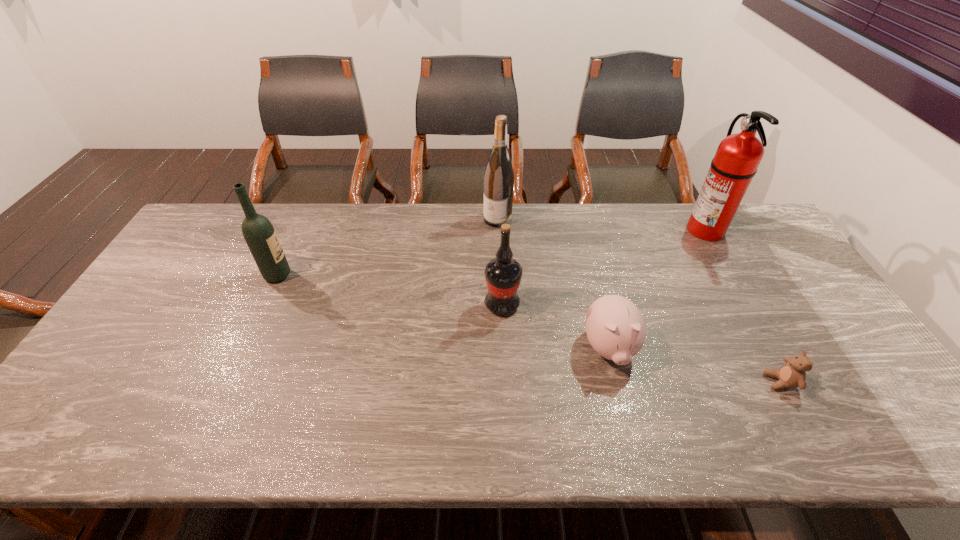
Identify the location of fire extinguisher. The width and height of the screenshot is (960, 540). (738, 156).

Where is `the farthest wine bottle`? This screenshot has width=960, height=540. the farthest wine bottle is located at coordinates (499, 177).

The width and height of the screenshot is (960, 540). What are the coordinates of `the fourth nearest object` in the screenshot? It's located at (259, 234).

This screenshot has height=540, width=960. What are the coordinates of `the leftmost object` in the screenshot? It's located at (259, 234).

Where is `the nearest wine bottle`? This screenshot has width=960, height=540. the nearest wine bottle is located at coordinates (503, 274).

At what (x,y) coordinates should I click in order to perform the action: click on piggy bank. Please return your answer as a coordinate pair (x, y). Looking at the image, I should click on (615, 327).

Image resolution: width=960 pixels, height=540 pixels. I want to click on the fifth tallest object, so click(x=615, y=327).

Image resolution: width=960 pixels, height=540 pixels. I want to click on the shortest object, so click(x=792, y=374).

Where is `free location located at the nozzle of the fire extinguisher`? The image size is (960, 540). free location located at the nozzle of the fire extinguisher is located at coordinates coord(569,230).

Where is `vacant position located 0.290m at the nozzle of the fire extinguisher`? Image resolution: width=960 pixels, height=540 pixels. vacant position located 0.290m at the nozzle of the fire extinguisher is located at coordinates (601, 230).